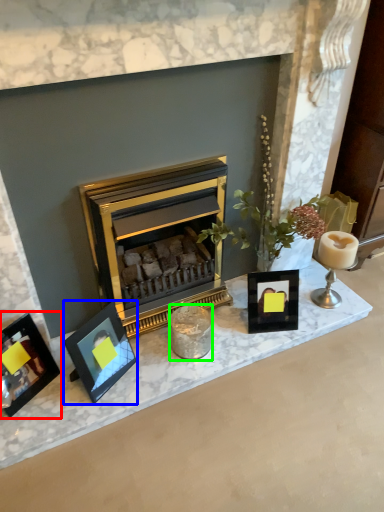
Question: Which object is the closest to the picture frame (highlighted by a red box)? Choose among these: picture frame (highlighted by a blue box) or candle holder (highlighted by a green box).

Choices:
 (A) picture frame
 (B) candle holder

Answer: (A)